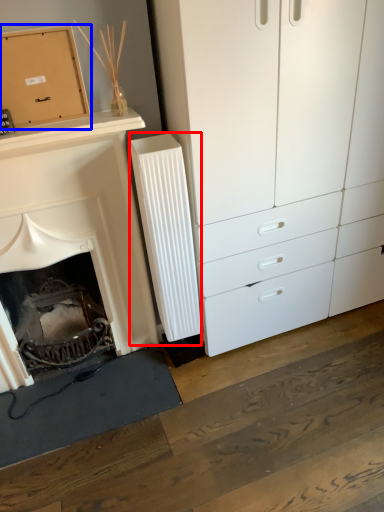
Question: Which object appears farthest to the camera in this image, radiator (highlighted by a red box) or cardboard box (highlighted by a blue box)?

Choices:
 (A) radiator
 (B) cardboard box

Answer: (A)